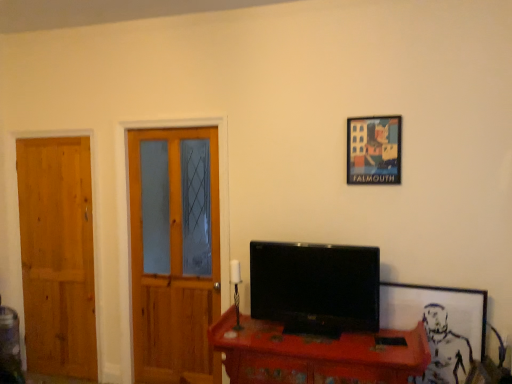
The height and width of the screenshot is (384, 512). I want to click on free point above natural wood door at left, placed as the first door when sorted from left to right (from a real-world perspective), so [x=52, y=135].